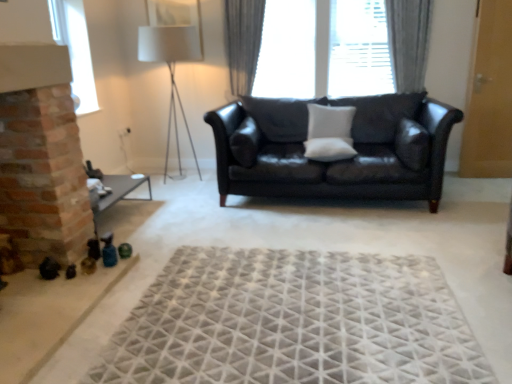
Question: In terms of size, does white fabric lampshade at upper center appear bigger or smaller than white matte pillow at center, the 1th pillow in the left-to-right sequence?

Choices:
 (A) small
 (B) big

Answer: (B)

Question: From their relative heights in the image, would you say white fabric lampshade at upper center is taller or shorter than white matte pillow at center, the 1th pillow in the left-to-right sequence?

Choices:
 (A) tall
 (B) short

Answer: (A)

Question: Based on their relative distances, which object is farther from the gray fabric curtain at upper center, the first curtain positioned from the left?

Choices:
 (A) white matte pillow at center, arranged as the third pillow when viewed from the right
 (B) transparent glass window at center, which is the 1th window from back to front
 (C) white matte pillow at center, positioned as the second pillow in right-to-left order
 (D) shiny black leather couch at center
 (E) gray fabric curtain at upper center, arranged as the 1th curtain when viewed from the right

Answer: (E)

Question: Which of these objects is positioned closest to the gray fabric curtain at upper center, the first curtain positioned from the left?

Choices:
 (A) white matte pillow at center, positioned as the second pillow in right-to-left order
 (B) white matte pillow at center, the 1th pillow in the left-to-right sequence
 (C) transparent glass window at center, marked as the second window in a left-to-right arrangement
 (D) shiny black leather couch at center
 (E) white fabric lampshade at upper center

Answer: (C)